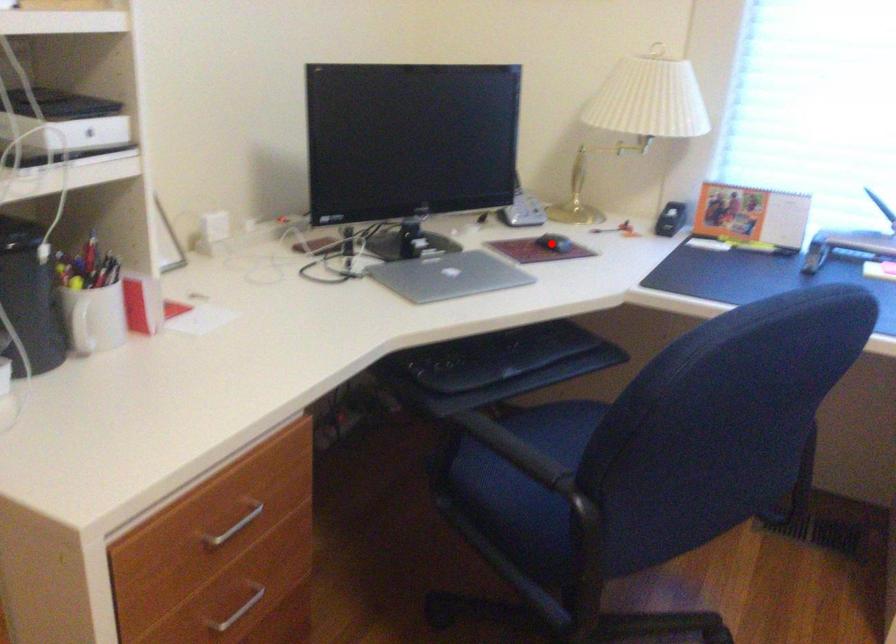
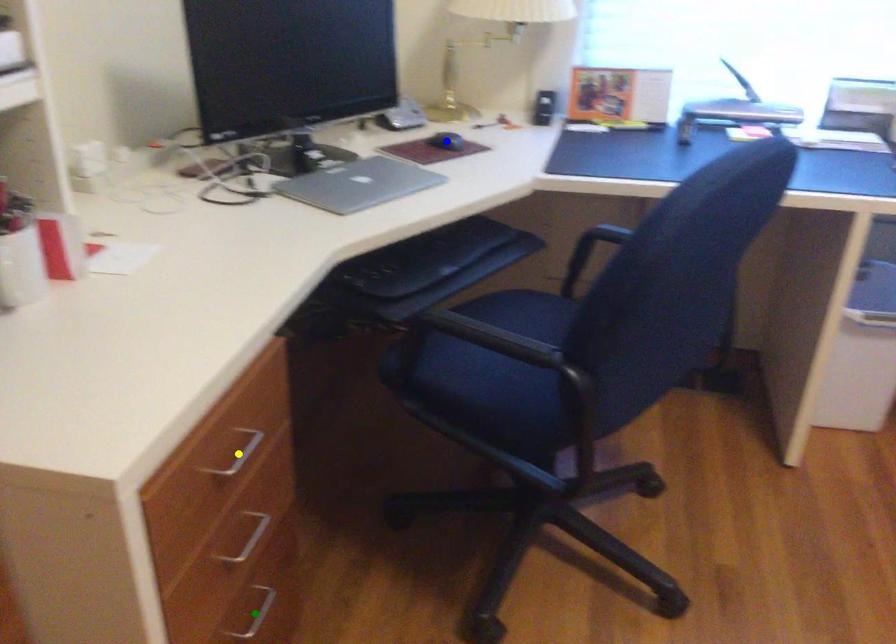
Question: I am providing you with two images of the same scene from different viewpoints. A red point is marked on the first image. You are given multiple points on the second image. Which point in image 2 represents the same 3d spot as the red point in image 1?

Choices:
 (A) yellow point
 (B) green point
 (C) blue point

Answer: (C)